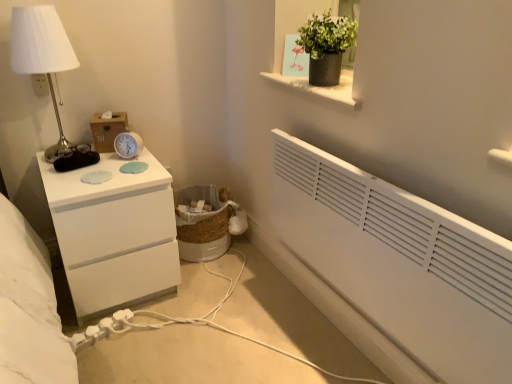
Question: In the image, is white plastic electric outlet at upper left on the left side or the right side of wooden tissue box at upper left?

Choices:
 (A) left
 (B) right

Answer: (A)

Question: From the image's perspective, relative to wooden tissue box at upper left, is white plastic electric outlet at upper left above or below?

Choices:
 (A) below
 (B) above

Answer: (B)

Question: Which of these objects is positioned farthest from the white plastic extension cord at lower left?

Choices:
 (A) matte black pot at upper center
 (B) white glossy chest of drawers at left
 (C) white plastic electric outlet at upper left
 (D) wooden tissue box at upper left
 (E) woven natural laundry basket at lower center

Answer: (A)

Question: Considering the real-world distances, which object is farthest from the white plastic extension cord at lower left?

Choices:
 (A) woven natural laundry basket at lower center
 (B) white plastic alarm clock at upper left
 (C) white metallic table lamp at left
 (D) white glossy chest of drawers at left
 (E) wooden tissue box at upper left

Answer: (C)